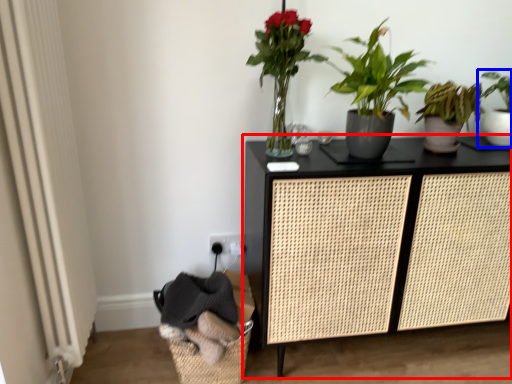
Question: Among these objects, which one is nearest to the camera, furniture (highlighted by a red box) or houseplant (highlighted by a blue box)?

Choices:
 (A) furniture
 (B) houseplant

Answer: (A)